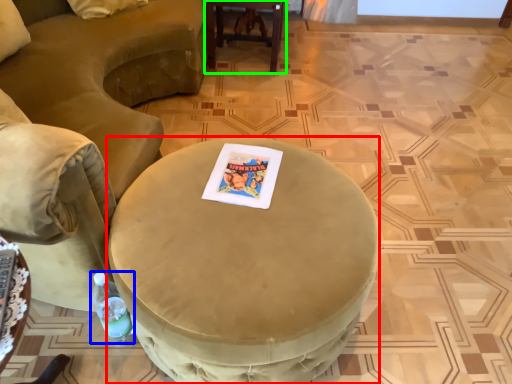
Question: Considering the real-world distances, which object is closest to coffee table (highlighted by a red box)? bottle (highlighted by a blue box) or table (highlighted by a green box).

Choices:
 (A) bottle
 (B) table

Answer: (A)